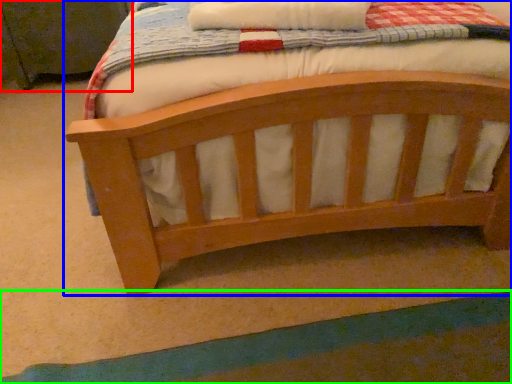
Question: Which object is positioned closest to changing table (highlighted by a red box)? Select from bed (highlighted by a blue box) and strip (highlighted by a green box).

Choices:
 (A) bed
 (B) strip

Answer: (A)